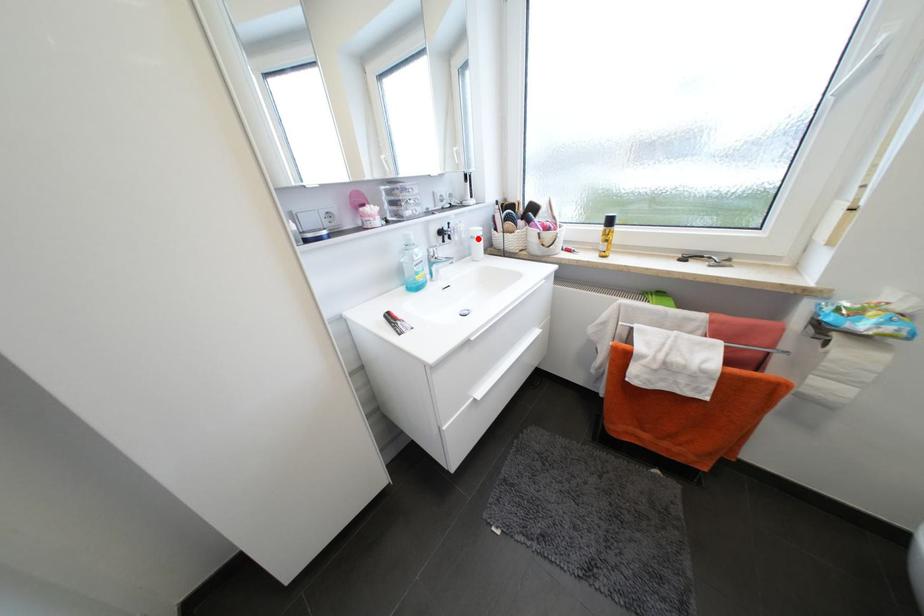
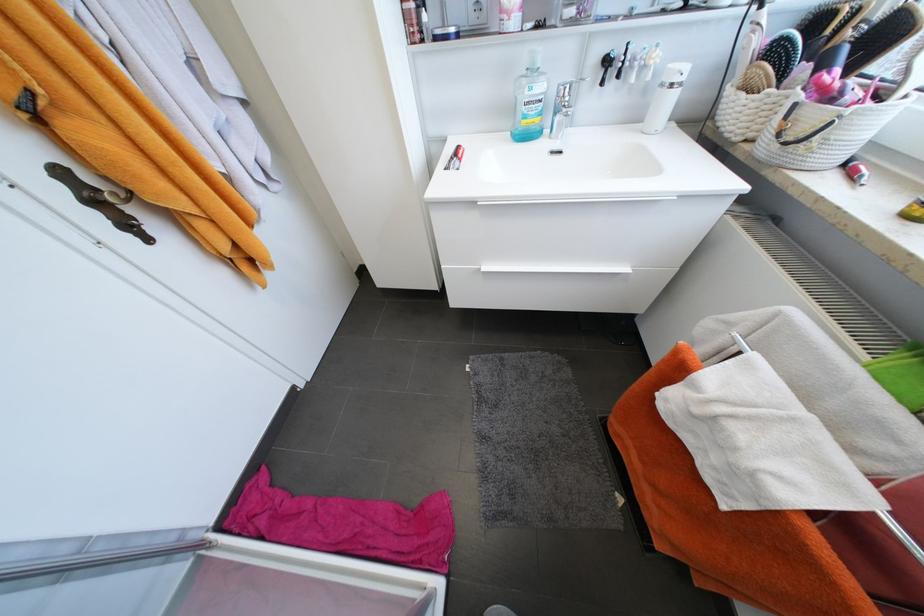
Where in the second image is the point corresponding to the highlighted location from the first image?

(667, 86)